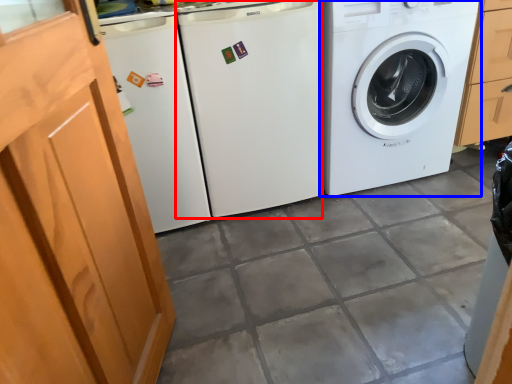
Question: Which object is closer to the camera taking this photo, washing machine (highlighted by a red box) or washing machine (highlighted by a blue box)?

Choices:
 (A) washing machine
 (B) washing machine

Answer: (A)